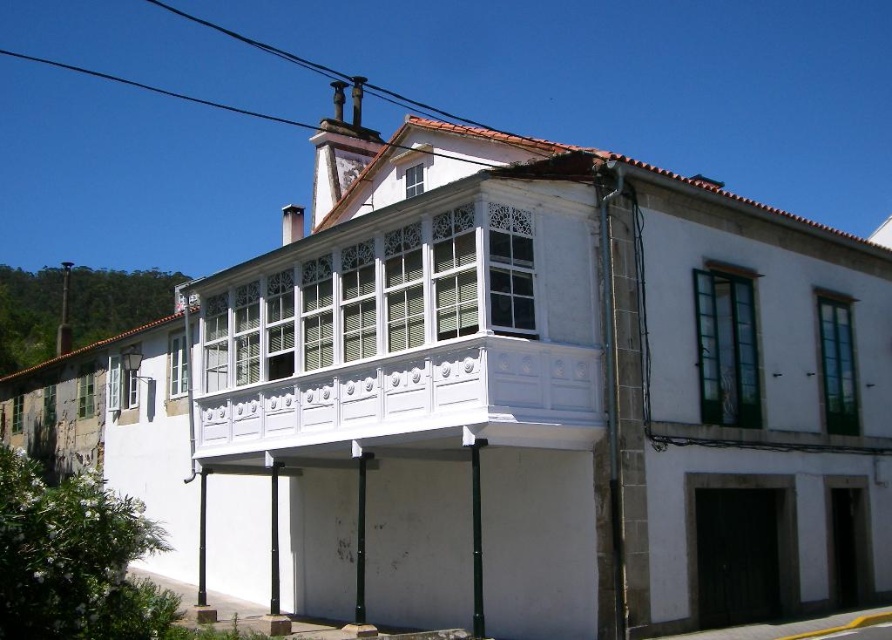
Between white wood balcony at upper center and black wire at upper center, which one is positioned higher?

black wire at upper center is above.

How far apart are white wood balcony at upper center and black wire at upper center?

They are 167.75 meters apart.

Describe the element at coordinates (406, 333) in the screenshot. I see `white wood balcony at upper center` at that location.

I want to click on white wood balcony at upper center, so click(406, 333).